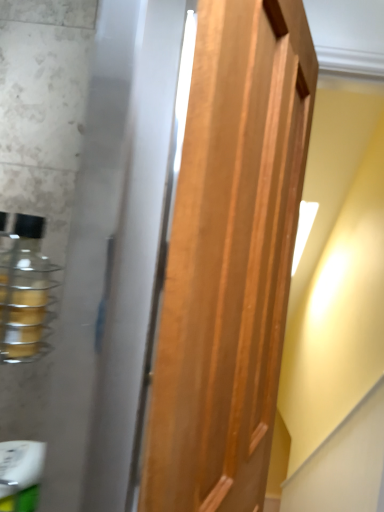
The height and width of the screenshot is (512, 384). Describe the element at coordinates (230, 258) in the screenshot. I see `wooden door at center` at that location.

Image resolution: width=384 pixels, height=512 pixels. Identify the location of wooden door at center. (230, 258).

Where is `wooden door at center`? wooden door at center is located at coordinates (230, 258).